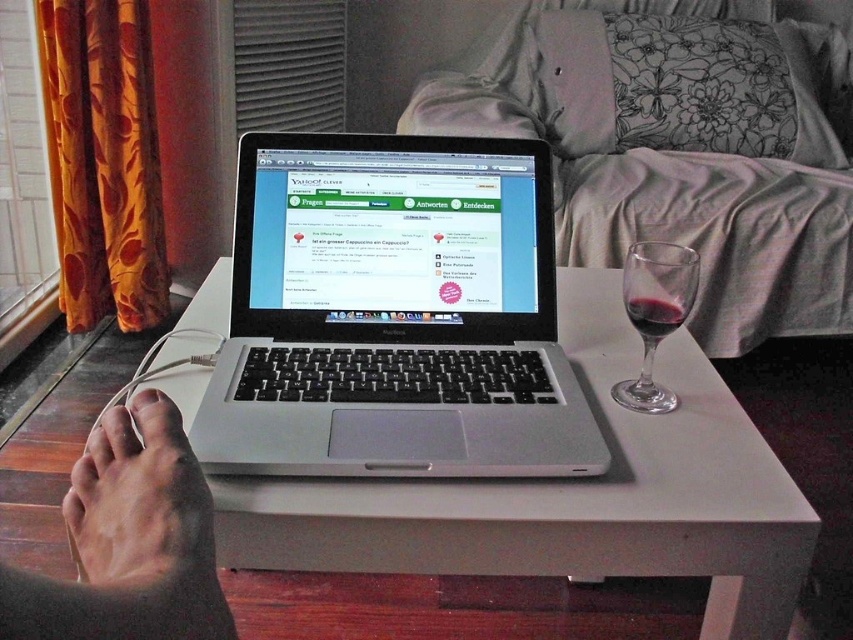
Question: Which point appears closest to the camera in this image?

Choices:
 (A) (635, 284)
 (B) (663, 332)
 (C) (303, 148)

Answer: (A)

Question: Which point is closer to the camera?

Choices:
 (A) satin glass wine at right
 (B) dry skin at lower left
 (C) silver/black laptop at center
 (D) white matte table at center

Answer: (B)

Question: Does silver/black laptop at center have a greater width compared to satin glass wine at right?

Choices:
 (A) no
 (B) yes

Answer: (A)

Question: Can you confirm if satin glass wine at right is wider than transparent glass at right?

Choices:
 (A) yes
 (B) no

Answer: (A)

Question: Is white matte table at center bigger than transparent glass at right?

Choices:
 (A) no
 (B) yes

Answer: (B)

Question: Considering the real-world distances, which object is farthest from the translucent glass at lower right?

Choices:
 (A) silver/black laptop at center
 (B) transparent glass at right
 (C) satin glass wine at right
 (D) white matte table at center

Answer: (C)